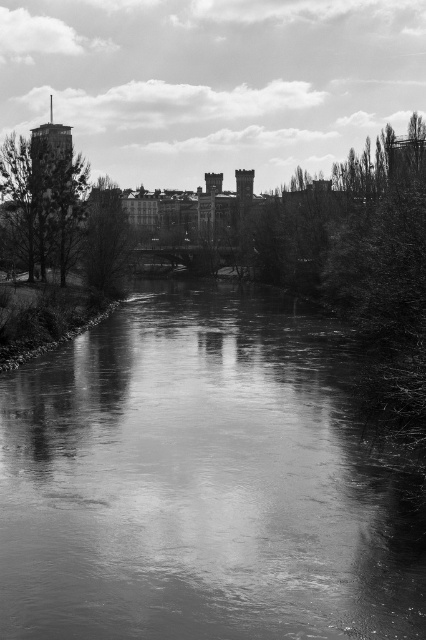
Is smooth water at center taller than smooth bark tree at left?

No, smooth water at center is not taller than smooth bark tree at left.

What do you see at coordinates (199, 483) in the screenshot?
I see `smooth water at center` at bounding box center [199, 483].

The image size is (426, 640). In order to click on smooth water at center in this screenshot , I will do `click(199, 483)`.

Is smooth water at center smaller than dark green leafy tree at center?

Incorrect, smooth water at center is not smaller in size than dark green leafy tree at center.

Is point (75, 625) farther from viewer compared to point (106, 280)?

No, it is in front of (106, 280).

Where is `smooth water at center`? This screenshot has height=640, width=426. smooth water at center is located at coordinates (199, 483).

Can you confirm if smooth bark tree at left is positioned above dark green leafy tree at center?

Indeed, smooth bark tree at left is positioned over dark green leafy tree at center.

Does smooth bark tree at left appear on the right side of dark green leafy tree at center?

No, smooth bark tree at left is not to the right of dark green leafy tree at center.

Is point (40, 244) more distant than point (100, 221)?

No, it is not.

Identify the location of smooth bark tree at left. The height and width of the screenshot is (640, 426). (62, 212).